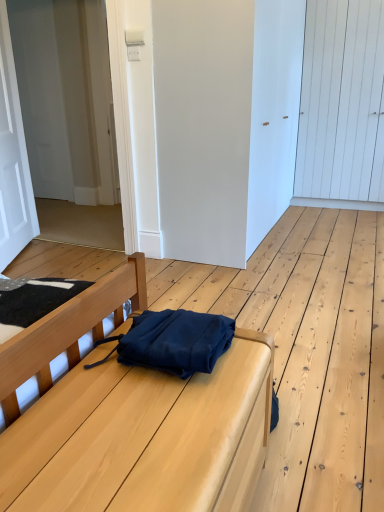
Question: Does white matte door at upper left, which is counted as the second door, starting from the left, have a smaller size compared to navy blue fabric messenger bag at center?

Choices:
 (A) yes
 (B) no

Answer: (B)

Question: Considering the relative sizes of white matte door at upper left, which is counted as the second door, starting from the left, and navy blue fabric messenger bag at center in the image provided, is white matte door at upper left, which is counted as the second door, starting from the left, taller than navy blue fabric messenger bag at center?

Choices:
 (A) no
 (B) yes

Answer: (B)

Question: Is white matte door at upper left, the 3th door viewed from the right, located outside navy blue fabric messenger bag at center?

Choices:
 (A) no
 (B) yes

Answer: (B)

Question: From the image's perspective, does white matte door at upper left, which is counted as the second door, starting from the left, appear higher than navy blue fabric messenger bag at center?

Choices:
 (A) yes
 (B) no

Answer: (A)

Question: From the image's perspective, is white matte door at upper left, which is counted as the second door, starting from the left, beneath navy blue fabric messenger bag at center?

Choices:
 (A) no
 (B) yes

Answer: (A)

Question: Does white matte door at upper left, which is counted as the second door, starting from the left, appear on the left side of navy blue fabric messenger bag at center?

Choices:
 (A) yes
 (B) no

Answer: (A)

Question: Is navy blue fabric at center at the right side of white wooden door at upper right, which is the 1th door in right-to-left order?

Choices:
 (A) yes
 (B) no

Answer: (B)

Question: Is navy blue fabric at center wider than white wooden door at upper right, which is the 1th door in right-to-left order?

Choices:
 (A) yes
 (B) no

Answer: (A)

Question: From the image's perspective, does navy blue fabric at center appear lower than white wooden door at upper right, which is the 1th door in right-to-left order?

Choices:
 (A) yes
 (B) no

Answer: (A)

Question: From the image's perspective, is navy blue fabric at center on top of white wooden door at upper right, which is the 1th door in right-to-left order?

Choices:
 (A) yes
 (B) no

Answer: (B)

Question: Is navy blue fabric at center not near white wooden door at upper right, acting as the fourth door starting from the left?

Choices:
 (A) yes
 (B) no

Answer: (A)

Question: Can you confirm if navy blue fabric at center is bigger than white wooden door at upper right, which is the 1th door in right-to-left order?

Choices:
 (A) yes
 (B) no

Answer: (B)

Question: Does navy blue fabric at center appear on the left side of white matte door at upper left, which is counted as the second door, starting from the left?

Choices:
 (A) no
 (B) yes

Answer: (A)